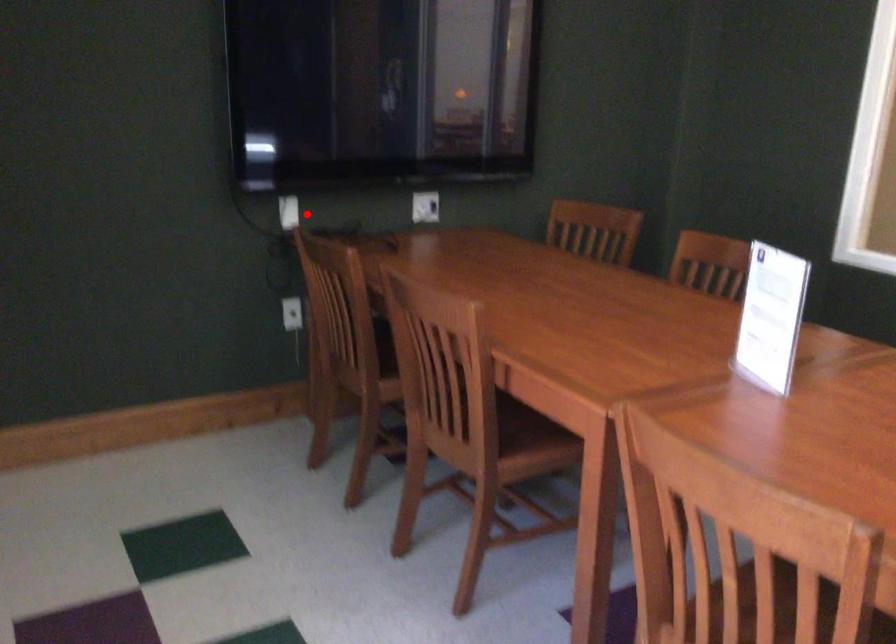
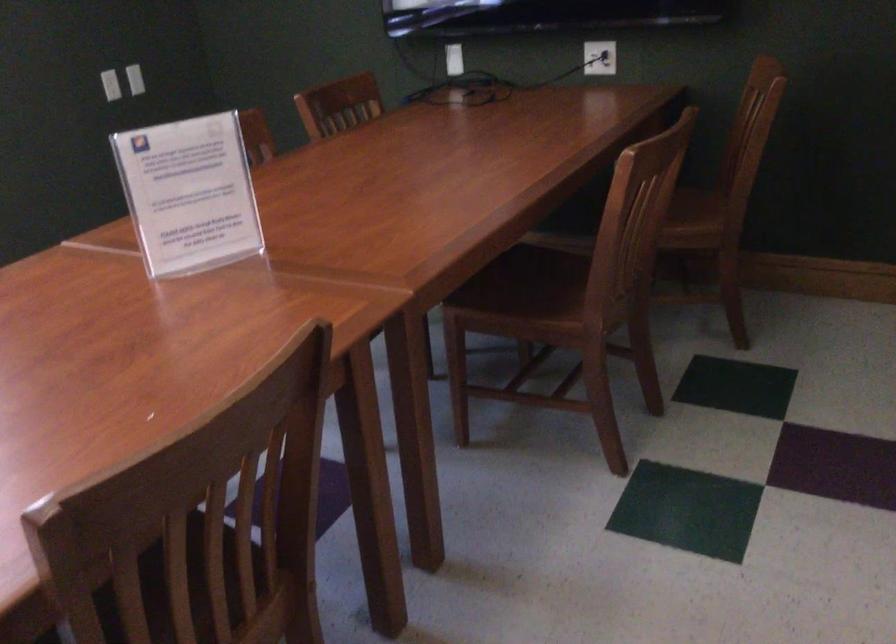
Question: I am providing you with two images of the same scene from different viewpoints. A red point is marked on the first image. At the location where the point appears in image 1, is it still visible in image 2?

Choices:
 (A) Yes
 (B) No

Answer: (A)